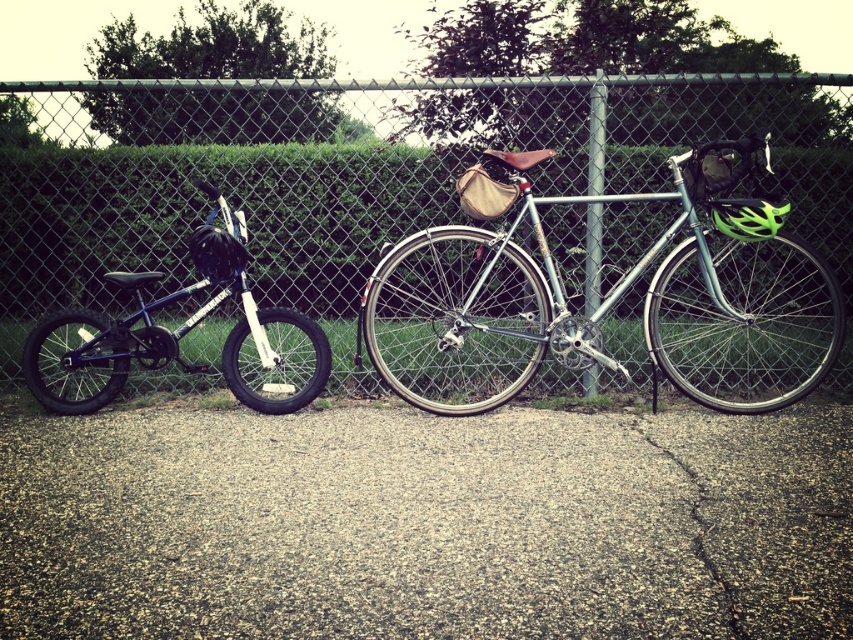
Is point (729, 406) more distant than point (254, 360)?

No, it is in front of (254, 360).

Which is more to the right, silver metallic bicycle at center or shiny blue bicycle at left?

silver metallic bicycle at center is more to the right.

Is point (461, 323) positioned behind point (67, 360)?

No, it is in front of (67, 360).

Find the location of a particular element. The height and width of the screenshot is (640, 853). silver metallic bicycle at center is located at coordinates (608, 304).

Between green chain-link fence at center and silver metallic bicycle at center, which one appears on the left side from the viewer's perspective?

green chain-link fence at center

Is green chain-link fence at center further to camera compared to silver metallic bicycle at center?

Yes, it is.

Does point (335, 189) lie in front of point (577, 316)?

No, it is behind (577, 316).

Image resolution: width=853 pixels, height=640 pixels. Identify the location of green chain-link fence at center. (357, 180).

How far apart are green chain-link fence at center and shiny blue bicycle at left?

green chain-link fence at center is 6.37 feet from shiny blue bicycle at left.

Does point (849, 148) come behind point (219, 248)?

Yes, it is behind point (219, 248).

Between point (310, 154) and point (241, 228), which one is positioned in front?

Positioned in front is point (241, 228).

At what (x,y) coordinates should I click in order to perform the action: click on green chain-link fence at center. Please return your answer as a coordinate pair (x, y). This screenshot has height=640, width=853. Looking at the image, I should click on (357, 180).